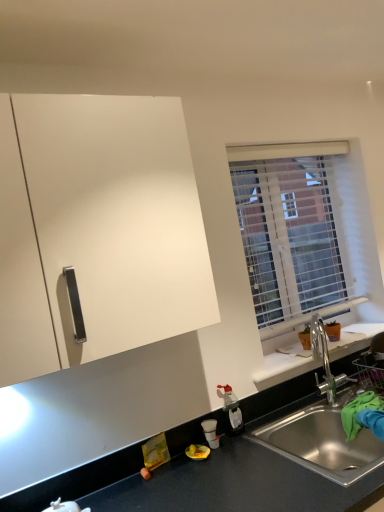
The image size is (384, 512). In order to click on free space above matte black countertop at lower center (from a real-world perspective) in this screenshot , I will do `click(201, 410)`.